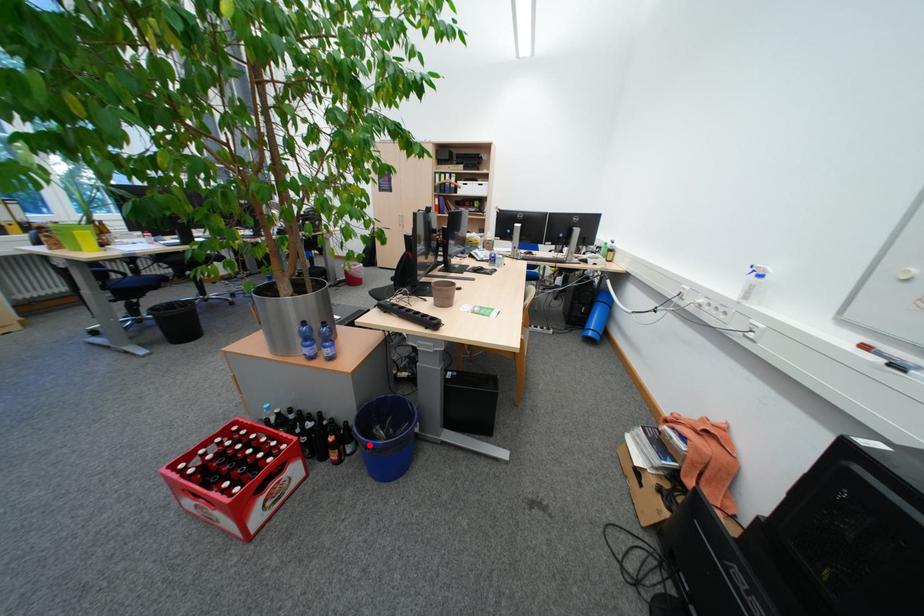
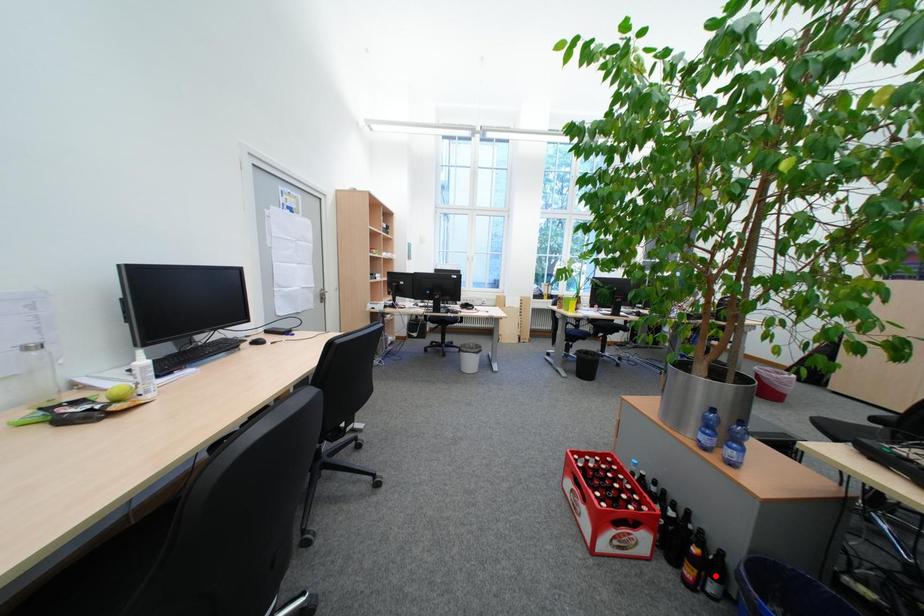
I am providing you with two images of the same scene from different viewpoints. A red point is marked on the first image and another point is marked on the second image. Do the highlighted points in image1 and image2 indicate the same real-world spot?

No